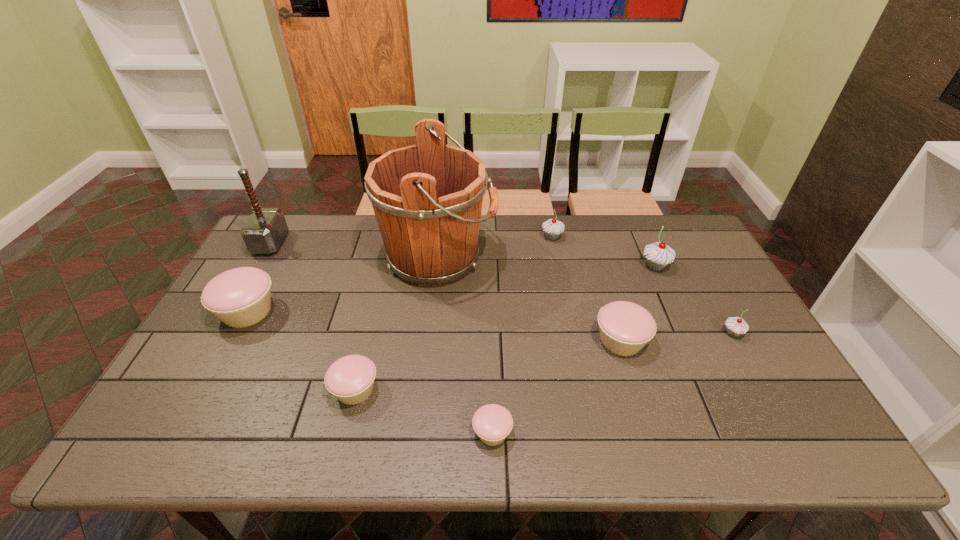
At what (x,y) coordinates should I click in order to perform the action: click on hammer located in the left edge section of the desktop. Please return your answer as a coordinate pair (x, y). This screenshot has height=540, width=960. Looking at the image, I should click on (264, 231).

Locate an element on the screen. cupcake situated at the left edge is located at coordinates (240, 297).

Locate an element on the screen. object positioned at the far left corner is located at coordinates (264, 231).

The height and width of the screenshot is (540, 960). I want to click on vacant space at the far edge of the desktop, so click(x=377, y=225).

Where is `free spot at the near edge of the desktop`? free spot at the near edge of the desktop is located at coordinates (400, 448).

In order to click on blank area at the left edge in this screenshot , I will do `click(292, 266)`.

Where is `vacant region at the right edge of the desktop`? Image resolution: width=960 pixels, height=540 pixels. vacant region at the right edge of the desktop is located at coordinates (753, 381).

The image size is (960, 540). What are the coordinates of `vacant region at the far left corner of the desktop` in the screenshot? It's located at (289, 215).

In the image, there is a desktop. Where is `vacant space at the near left corner`? vacant space at the near left corner is located at coordinates (175, 435).

I want to click on free spot between the second nearest object and the rightmost gray cupcake, so click(543, 361).